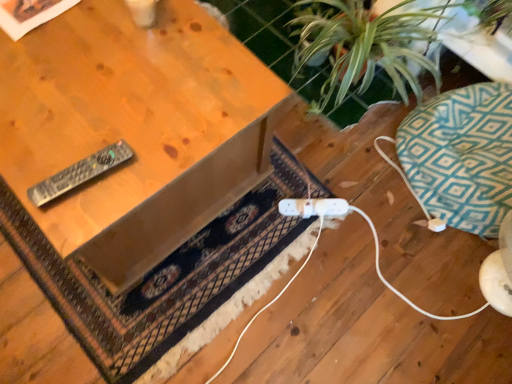
At what (x,y) coordinates should I click in order to perform the action: click on vacant space situated on the left part of white plastic plug at lower center. Please return your answer as a coordinate pair (x, y). The height and width of the screenshot is (384, 512). Looking at the image, I should click on (265, 210).